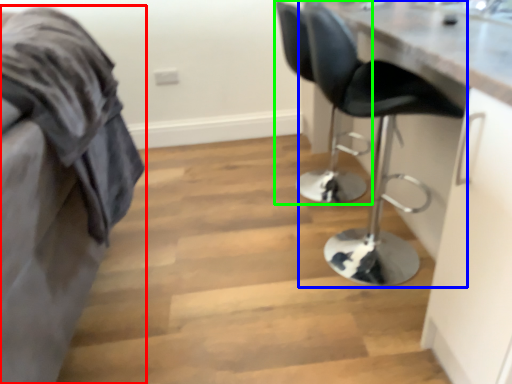
Question: Estimate the real-world distances between objects in this image. Which object is farther from furniture (highlighted by a red box), chair (highlighted by a blue box) or chair (highlighted by a green box)?

Choices:
 (A) chair
 (B) chair

Answer: (B)